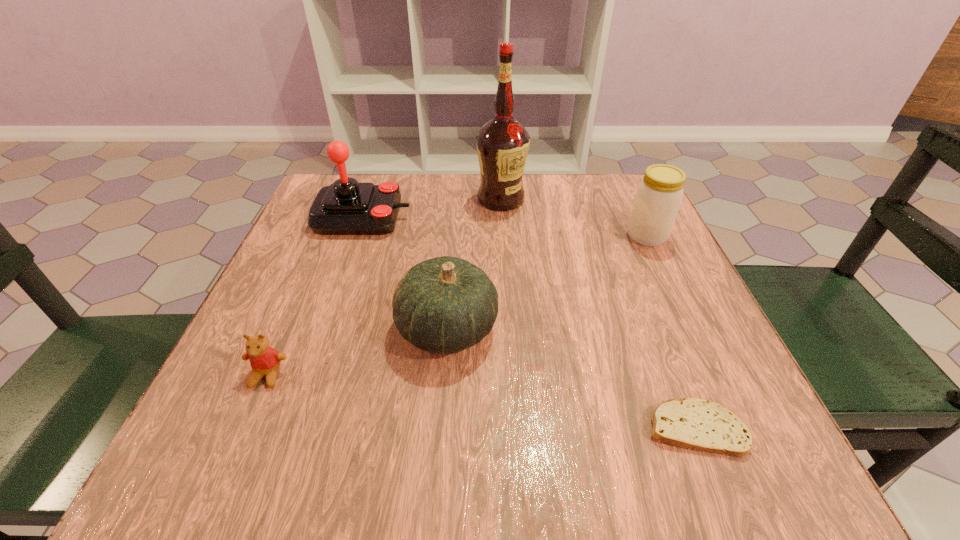
Identify the location of free area in between the gourd and the second shortest object. This screenshot has height=540, width=960. (357, 352).

The height and width of the screenshot is (540, 960). What are the coordinates of `vacant region between the shortest object and the joystick` in the screenshot? It's located at (529, 322).

Where is `free space between the teddy bear and the pita bread`? This screenshot has width=960, height=540. free space between the teddy bear and the pita bread is located at coordinates (x=481, y=401).

Identify the location of free space between the alcohol and the joystick. (432, 208).

Image resolution: width=960 pixels, height=540 pixels. I want to click on vacant space in between the gourd and the pita bread, so click(x=571, y=377).

The height and width of the screenshot is (540, 960). Find the location of `free space between the gourd and the alcohol`. free space between the gourd and the alcohol is located at coordinates (474, 264).

Locate an element on the screen. free space between the jar and the pita bread is located at coordinates (671, 332).

You are a GUI agent. You are given a task and a screenshot of the screen. Output one action in this format:
    pyautogui.click(x=<x>, y=<y>)
    Task: Click on the unoccupied position between the pita bread and the tallest object
    This screenshot has width=960, height=540.
    Given the screenshot: What is the action you would take?
    pyautogui.click(x=598, y=313)

Locate an element on the screen. This screenshot has height=540, width=960. free point between the gourd and the shortest object is located at coordinates (571, 377).

Find the location of a particular element. The width and height of the screenshot is (960, 540). vacant point located between the nearest object and the joystick is located at coordinates pyautogui.click(x=529, y=322).